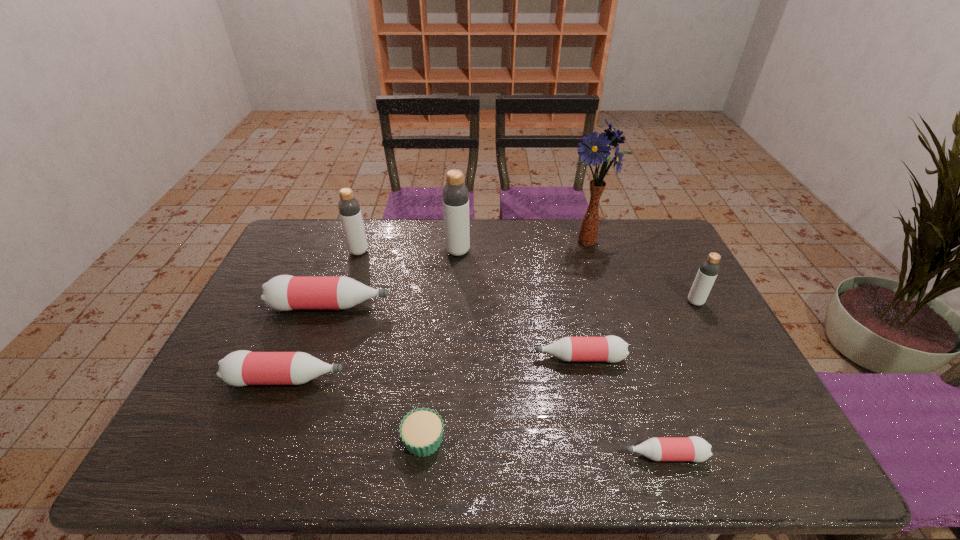
Identify the location of flower arrangement present at the far edge. (594, 149).

Where is `cupcake that is at the near edge`? The height and width of the screenshot is (540, 960). cupcake that is at the near edge is located at coordinates (421, 430).

I want to click on bottle at the near edge, so click(x=695, y=449).

I want to click on object that is at the right edge, so click(709, 268).

In the image, there is a desktop. What are the coordinates of `vacant space at the near edge` in the screenshot? It's located at (494, 454).

In the image, there is a desktop. Where is `vacant space at the left edge`? This screenshot has width=960, height=540. vacant space at the left edge is located at coordinates (189, 429).

You are a GUI agent. You are given a task and a screenshot of the screen. Output one action in this format:
    pyautogui.click(x=<x>, y=<y>)
    Task: Click on the vacant space at the right edge
    The width and height of the screenshot is (960, 540).
    Given the screenshot: What is the action you would take?
    pyautogui.click(x=748, y=422)

In the image, there is a desktop. Find the location of `vacant region at the far left corner`. vacant region at the far left corner is located at coordinates (315, 239).

In the image, there is a desktop. Identify the location of free region at the near left corner. This screenshot has height=540, width=960. (183, 458).

In the image, there is a desktop. Where is `vacant space at the far right corner`? This screenshot has width=960, height=540. vacant space at the far right corner is located at coordinates (649, 231).